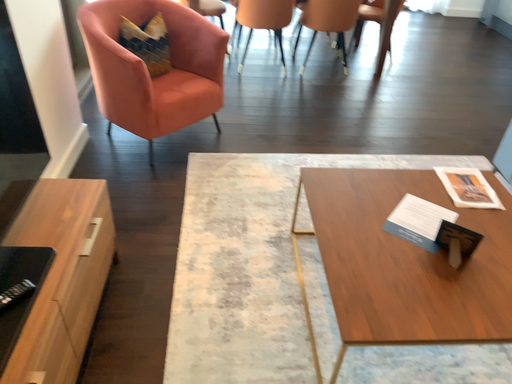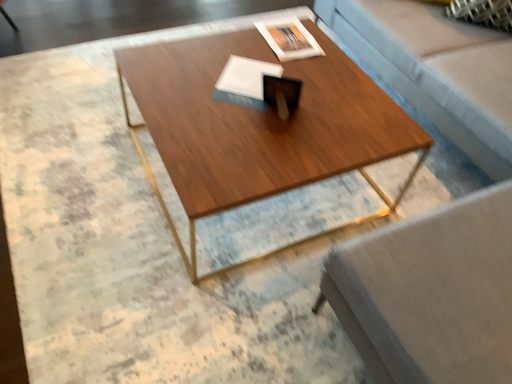
Question: How did the camera likely rotate when shooting the video?

Choices:
 (A) rotated left
 (B) rotated right

Answer: (B)